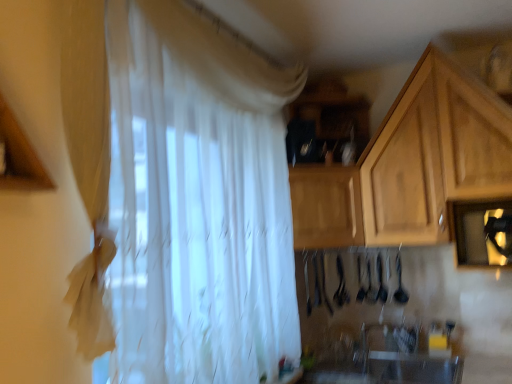
Question: Based on their positions, is white sheer curtain at center located to the left or right of white glossy sink at lower center?

Choices:
 (A) right
 (B) left

Answer: (B)

Question: Is white sheer curtain at center situated inside white glossy sink at lower center or outside?

Choices:
 (A) outside
 (B) inside

Answer: (A)

Question: Estimate the real-world distances between objects in this image. Which object is closer to the wooden cabinet at upper right, which ranks as the first cabinetry in right-to-left order?

Choices:
 (A) white sheer curtain at center
 (B) white glossy sink at lower center
 (C) wooden cabinet at center, the first cabinetry from the left

Answer: (C)

Question: Which object is positioned farthest from the wooden cabinet at upper right, which is counted as the 2th cabinetry, starting from the left?

Choices:
 (A) white sheer curtain at center
 (B) white glossy sink at lower center
 (C) wooden cabinet at center, the first cabinetry from the left

Answer: (B)